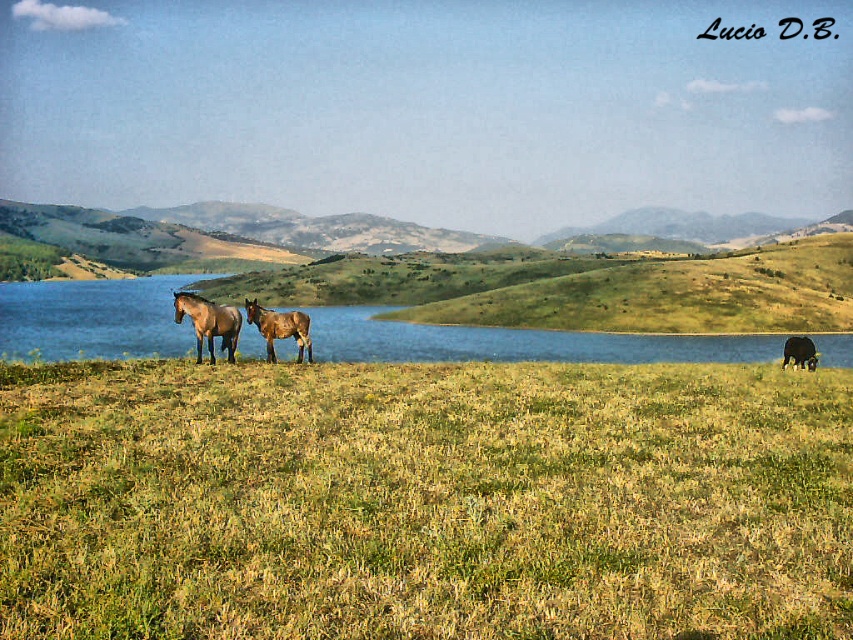
How distant is blue water at center from brown glossy horse at center?

blue water at center and brown glossy horse at center are 36.23 meters apart from each other.

Which is in front, point (44, 294) or point (805, 358)?

Point (805, 358) is in front.

Between point (277, 348) and point (808, 340), which one is positioned in front?

Positioned in front is point (277, 348).

In order to click on blue water at center in this screenshot , I will do `click(517, 342)`.

Who is shorter, brown matte horse at center or brown glossy horse at center?

brown glossy horse at center

Which is in front, point (270, 346) or point (784, 340)?

Point (270, 346) is in front.

What are the coordinates of `brown matte horse at center` in the screenshot? It's located at (280, 326).

Which is below, green grassy field at lower center or brown glossy horse at left?

green grassy field at lower center

Does green grassy field at lower center have a lesser width compared to brown glossy horse at left?

No.

Is point (244, 502) positioned behind point (189, 305)?

That is False.

Where is `green grassy field at lower center`? green grassy field at lower center is located at coordinates (424, 500).